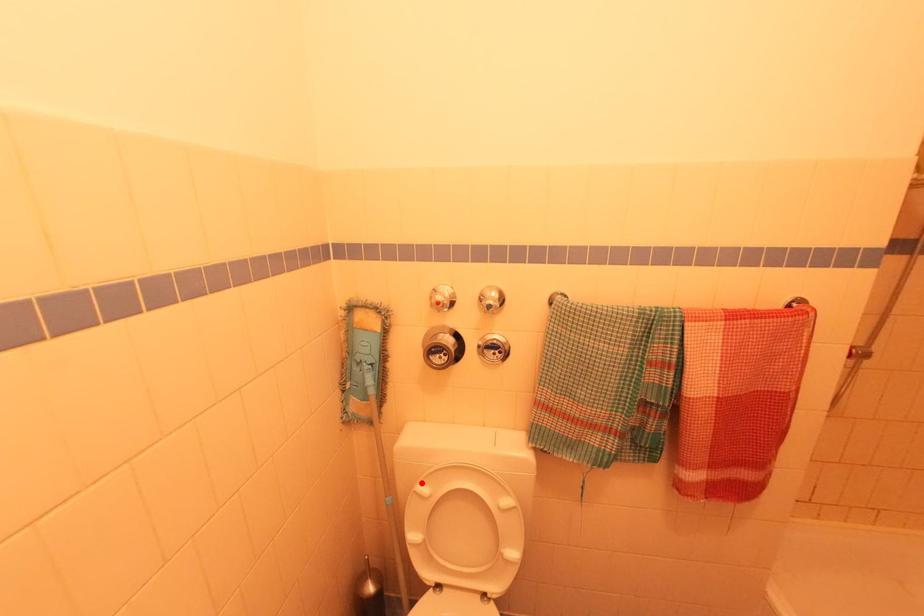
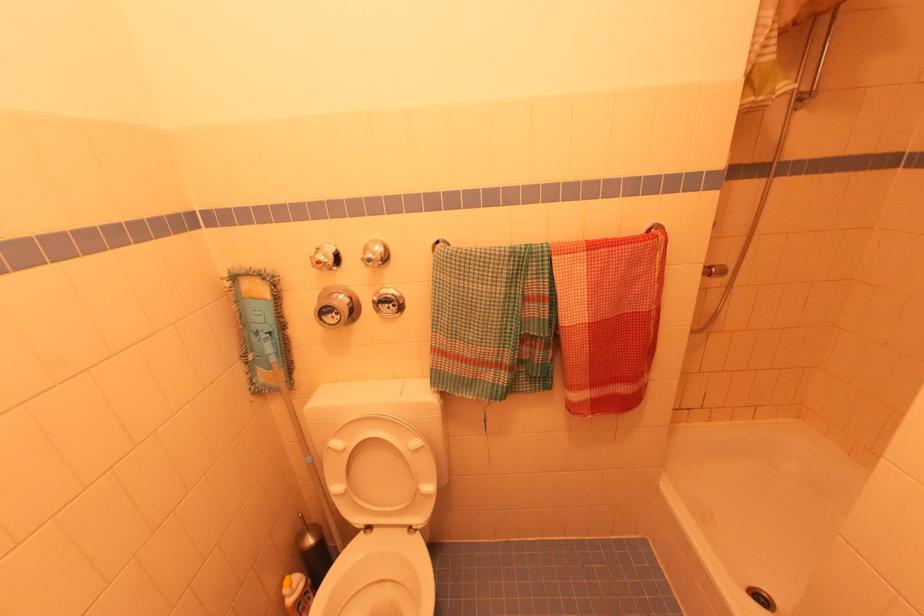
Find the pixel in the second image that matches the highlighted location in the first image.

(334, 439)